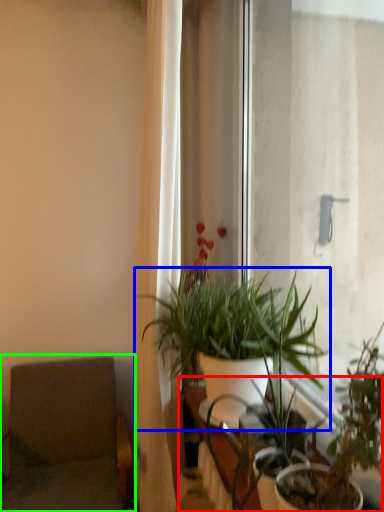
Question: Which object is positioned closest to table (highlighted by a red box)? Select from houseplant (highlighted by a blue box) and swivel chair (highlighted by a green box).

Choices:
 (A) houseplant
 (B) swivel chair

Answer: (A)